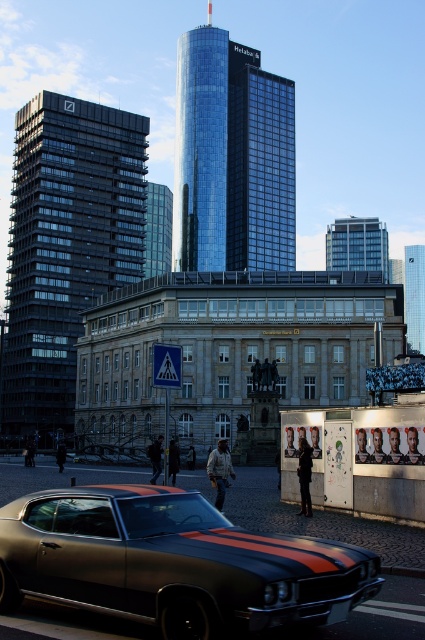
You are an architect analyzing the urban skyline. Given the dark glass skyscraper at left and the glassy reflective skyscraper at center, which one appears taller from your vantage point?

The glassy reflective skyscraper at center is taller than the dark glass skyscraper at left.

You are an architect analyzing the urban skyline. Given the dark glass skyscraper at left and the silver glass skyscraper at center, which one appears lower in the image?

The dark glass skyscraper at left appears lower in the image as it is positioned below the silver glass skyscraper at center.

You are standing in the urban scene and want to take a photo of the dark glass skyscraper at left. Considering your camera can focus on objects up to 100 meters away, will you be able to capture a clear image of it?

The dark glass skyscraper at left is 101.73 meters from the viewer, which exceeds the camera maximum focus range of 100 meters. Therefore, the camera cannot focus on it clearly.